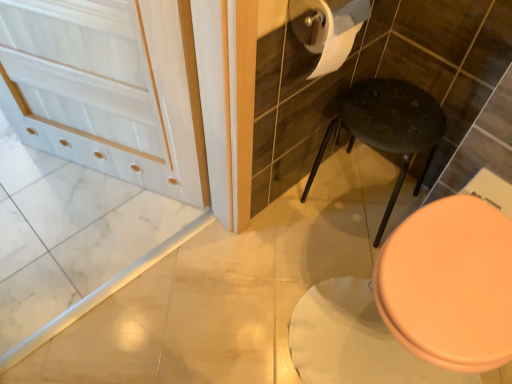
Question: Considering the relative positions of dark speckled plastic stool at center and pink glossy toilet seat at lower right in the image provided, is dark speckled plastic stool at center to the right of pink glossy toilet seat at lower right from the viewer's perspective?

Choices:
 (A) yes
 (B) no

Answer: (B)

Question: From a real-world perspective, does dark speckled plastic stool at center sit lower than pink glossy toilet seat at lower right?

Choices:
 (A) no
 (B) yes

Answer: (B)

Question: From the image's perspective, is dark speckled plastic stool at center above pink glossy toilet seat at lower right?

Choices:
 (A) no
 (B) yes

Answer: (B)

Question: Is there a large distance between dark speckled plastic stool at center and pink glossy toilet seat at lower right?

Choices:
 (A) no
 (B) yes

Answer: (A)

Question: Is dark speckled plastic stool at center turned away from pink glossy toilet seat at lower right?

Choices:
 (A) no
 (B) yes

Answer: (A)

Question: Does dark speckled plastic stool at center lie behind pink glossy toilet seat at lower right?

Choices:
 (A) no
 (B) yes

Answer: (B)

Question: Is pink glossy toilet seat at lower right facing towards dark speckled plastic stool at center?

Choices:
 (A) yes
 (B) no

Answer: (B)

Question: Is pink glossy toilet seat at lower right at the right side of dark speckled plastic stool at center?

Choices:
 (A) no
 (B) yes

Answer: (B)

Question: Can you confirm if pink glossy toilet seat at lower right is bigger than dark speckled plastic stool at center?

Choices:
 (A) yes
 (B) no

Answer: (A)

Question: From a real-world perspective, is pink glossy toilet seat at lower right physically above dark speckled plastic stool at center?

Choices:
 (A) no
 (B) yes

Answer: (B)

Question: Is pink glossy toilet seat at lower right closer to the viewer compared to dark speckled plastic stool at center?

Choices:
 (A) yes
 (B) no

Answer: (A)

Question: From a real-world perspective, is pink glossy toilet seat at lower right under dark speckled plastic stool at center?

Choices:
 (A) yes
 (B) no

Answer: (B)

Question: From a real-world perspective, is white matte screen door at upper left over dark speckled plastic stool at center?

Choices:
 (A) yes
 (B) no

Answer: (A)